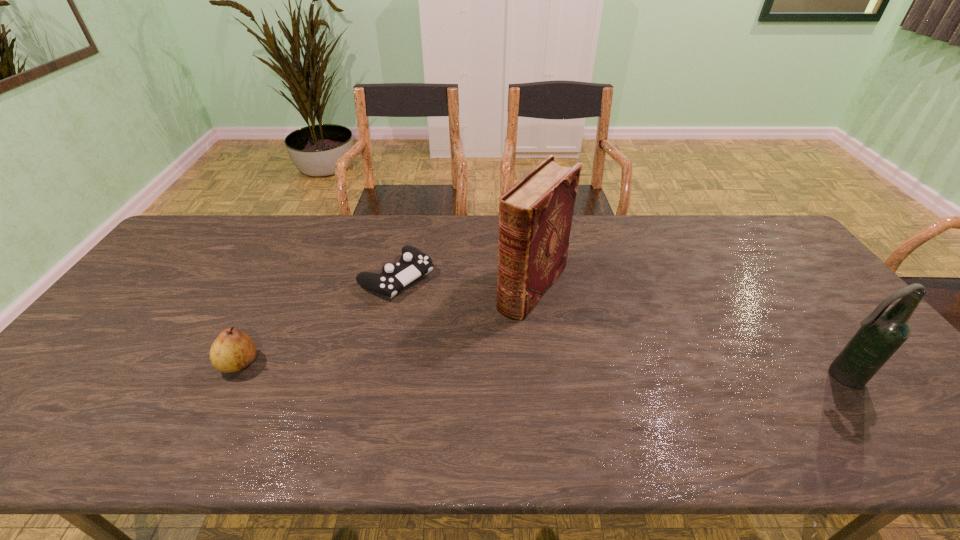
Locate an element on the screen. This screenshot has width=960, height=540. vacant space located on the surface of the shortest object is located at coordinates (472, 327).

Find the location of `blank space located on the surface of the shortest object`. blank space located on the surface of the shortest object is located at coordinates (490, 339).

Image resolution: width=960 pixels, height=540 pixels. I want to click on vacant area situated 0.310m on the surface of the shortest object, so click(x=504, y=348).

Image resolution: width=960 pixels, height=540 pixels. In order to click on vacant space located on the spine side of the second object from right to left in this screenshot , I will do `click(476, 360)`.

I want to click on vacant space located on the spine side of the second object from right to left, so click(440, 404).

The height and width of the screenshot is (540, 960). In order to click on free point located 0.220m on the spine side of the second object from right to left in this screenshot , I will do `click(469, 368)`.

Locate an element on the screen. object that is at the far edge is located at coordinates (413, 263).

You are a GUI agent. You are given a task and a screenshot of the screen. Output one action in this format:
    pyautogui.click(x=<x>, y=<y>)
    Task: Click on the pear situated at the near edge
    The height and width of the screenshot is (540, 960).
    Given the screenshot: What is the action you would take?
    pyautogui.click(x=232, y=351)

Locate an element on the screen. This screenshot has height=540, width=960. beer bottle that is positioned at the near edge is located at coordinates (882, 333).

In order to click on object present at the right edge in this screenshot , I will do `click(882, 333)`.